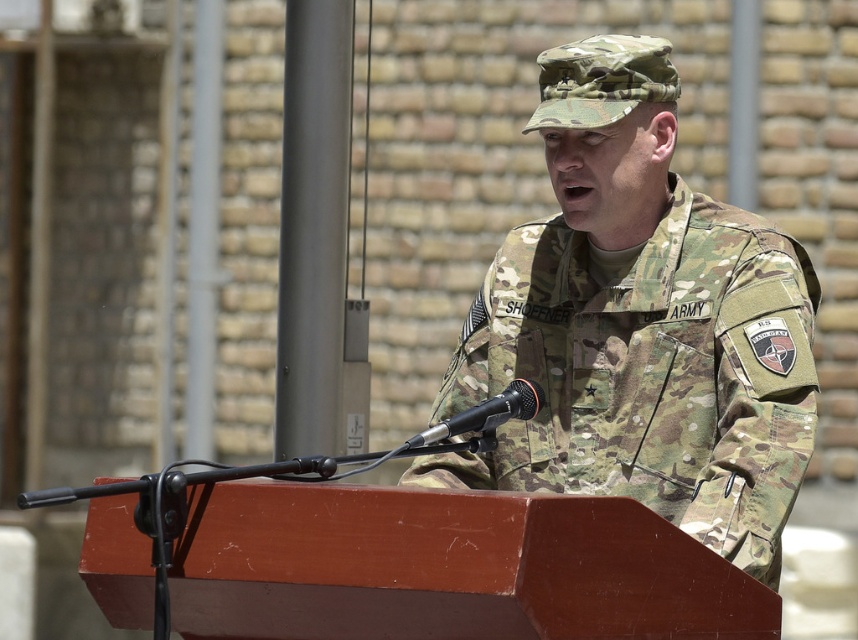
Which is more to the right, camo uniform at center or black matte microphone at center?

camo uniform at center

Does point (811, 369) come farther from viewer compared to point (482, 408)?

Yes.

What do you see at coordinates (639, 324) in the screenshot? I see `camo uniform at center` at bounding box center [639, 324].

The width and height of the screenshot is (858, 640). Identify the location of camo uniform at center. [639, 324].